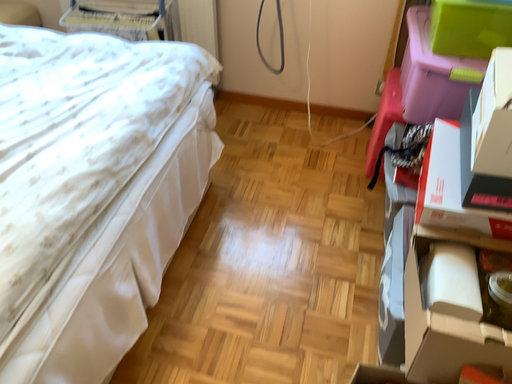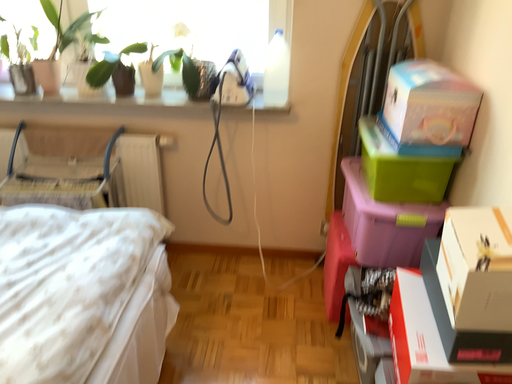
Question: Which way did the camera rotate in the video?

Choices:
 (A) rotated right
 (B) rotated left

Answer: (A)